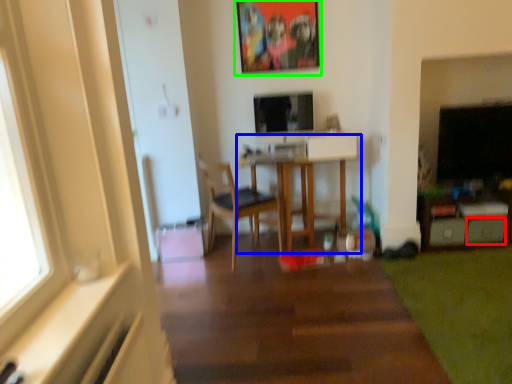
Question: Which object is the farthest from drawer (highlighted by a red box)? Choose among these: table (highlighted by a blue box) or picture frame (highlighted by a green box).

Choices:
 (A) table
 (B) picture frame

Answer: (B)